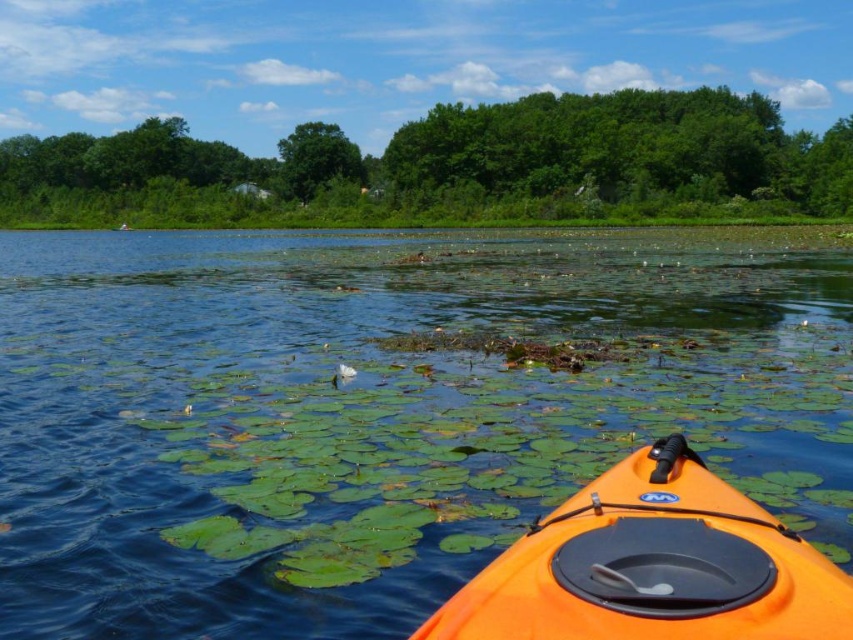
Does transparent water at center have a smaller size compared to orange matte kayak at lower right?

Incorrect, transparent water at center is not smaller in size than orange matte kayak at lower right.

Is transparent water at center positioned at the back of orange matte kayak at lower right?

That is True.

This screenshot has height=640, width=853. What are the coordinates of `transparent water at center` in the screenshot? It's located at (376, 413).

Where is `transparent water at center`? This screenshot has width=853, height=640. transparent water at center is located at coordinates (376, 413).